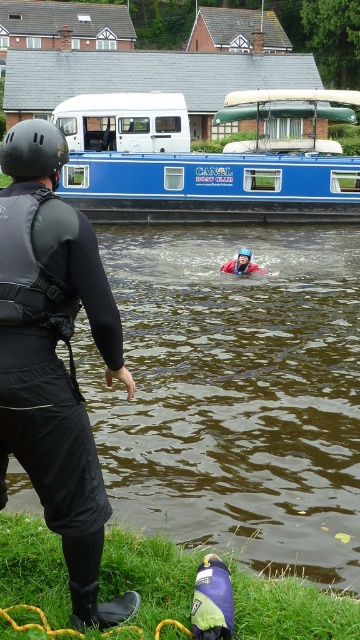
Is brown murky water at center shorter than red life jacket at center?

No.

Is point (288, 412) more distant than point (240, 266)?

That is False.

The height and width of the screenshot is (640, 360). Find the location of `brown murky water at center`. brown murky water at center is located at coordinates (235, 392).

Between point (110, 173) and point (257, 269), which one is positioned behind?

Positioned behind is point (110, 173).

Who is lower down, blue polished wood canal boat at upper center or red fleece life jacket at center?

red fleece life jacket at center

This screenshot has height=640, width=360. I want to click on blue polished wood canal boat at upper center, so click(205, 161).

At what (x,y) coordinates should I click in order to perform the action: click on blue polished wood canal boat at upper center. Please return your answer as a coordinate pair (x, y). Image resolution: width=360 pixels, height=640 pixels. Looking at the image, I should click on [205, 161].

What are the coordinates of `brown murky water at center` in the screenshot? It's located at (235, 392).

Does point (232, 413) come in front of point (249, 269)?

Yes, point (232, 413) is in front of point (249, 269).

The height and width of the screenshot is (640, 360). Identify the location of brown murky water at center. (235, 392).